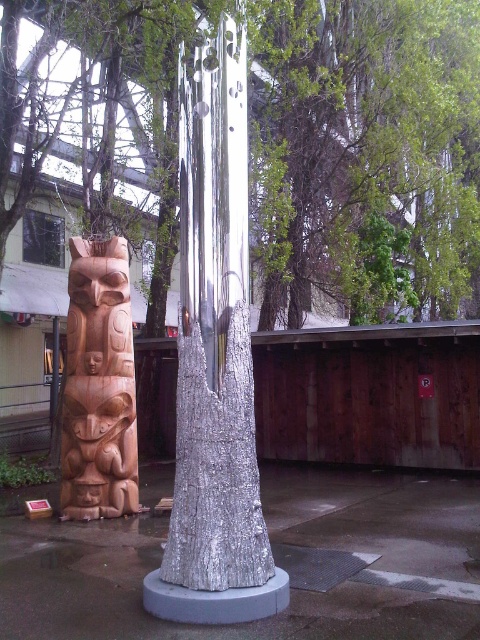
Is the position of wooden totem pole at center less distant than that of shiny metallic tree at center?

No, it is behind shiny metallic tree at center.

Is wooden totem pole at center taller than shiny metallic tree at center?

Indeed, wooden totem pole at center has a greater height compared to shiny metallic tree at center.

What do you see at coordinates (368, 132) in the screenshot?
I see `wooden totem pole at center` at bounding box center [368, 132].

Locate an element on the screen. wooden totem pole at center is located at coordinates coord(368,132).

Is point (229, 74) farther from camera compared to point (172, 531)?

Yes, point (229, 74) is farther from viewer.

Which is more to the left, shiny metallic tree at center or shiny metallic tree trunk at center?

shiny metallic tree trunk at center is more to the left.

Does point (180, 138) come in front of point (225, 502)?

No, (180, 138) is further to viewer.

You are a GUI agent. You are given a task and a screenshot of the screen. Output one action in this format:
    pyautogui.click(x=<x>, y=<y>)
    Task: Click on the shiny metallic tree at center
    The width and height of the screenshot is (480, 640).
    Given the screenshot: What is the action you would take?
    pyautogui.click(x=215, y=336)

The image size is (480, 640). I want to click on shiny metallic tree trunk at center, so click(x=216, y=467).

Is point (265, 570) positioned in front of point (87, 328)?

That is True.

Where is `shiny metallic tree trunk at center`? The image size is (480, 640). shiny metallic tree trunk at center is located at coordinates (216, 467).